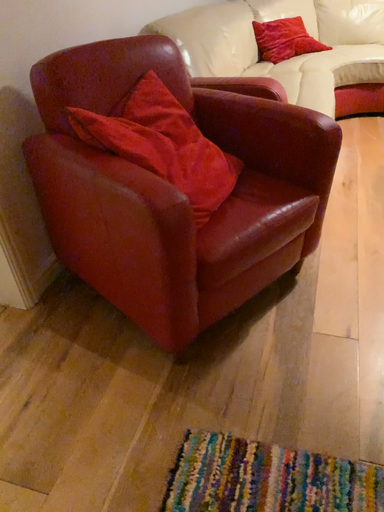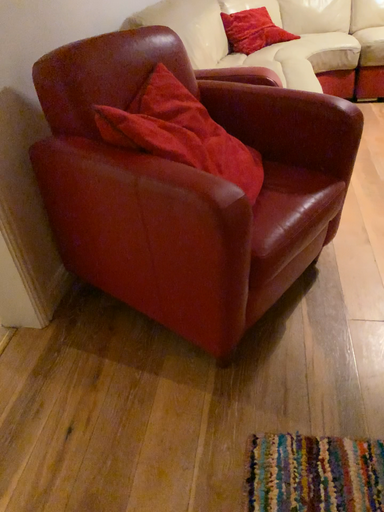
Question: How did the camera likely rotate when shooting the video?

Choices:
 (A) rotated right
 (B) rotated left

Answer: (A)